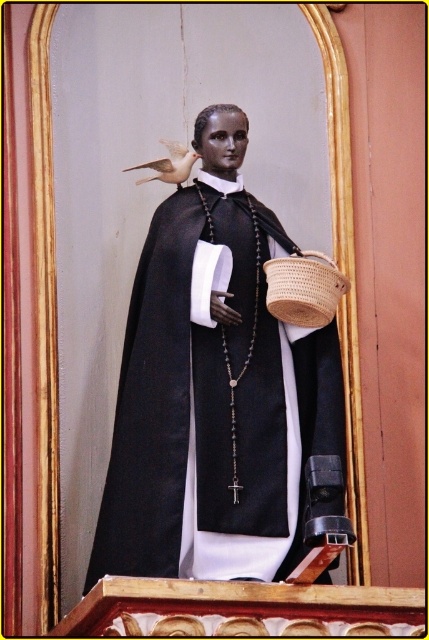
You are an art curator planning to display the matte black statue at center and the woven brown basket at lower right in a new exhibition. You need to ensure that the statue is visible above the basket. Based on the scene description, will the statue naturally stand out taller than the basket?

The matte black statue at center is taller than woven brown basket at lower right, so yes, the statue will naturally stand out taller than the basket in the exhibition.

You are a maintenance worker needing to clean both the woven brown basket at lower right and the matte white bird at upper left. Given that your ladder can extend up to 6 meters, can you reach both objects without needing a taller ladder?

The distance between the woven brown basket at lower right and the matte white bird at upper left is 7.11 meters. Since your ladder only extends to 6 meters, you cannot reach both objects without a taller ladder.